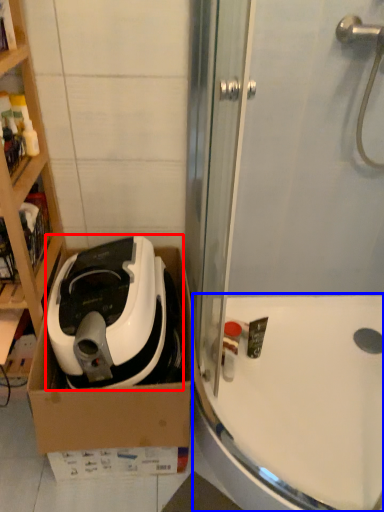
Question: Which object is further to the camera taking this photo, home appliance (highlighted by a red box) or bath (highlighted by a blue box)?

Choices:
 (A) home appliance
 (B) bath

Answer: (B)